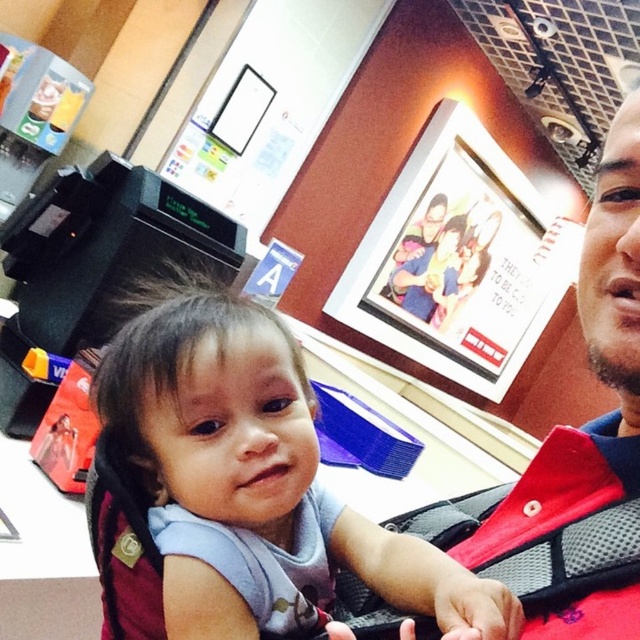
Does smooth blue bib at center appear on the left side of matte red shirt at upper right?

Correct, you'll find smooth blue bib at center to the left of matte red shirt at upper right.

Between smooth blue bib at center and matte red shirt at upper right, which one appears on the left side from the viewer's perspective?

From the viewer's perspective, smooth blue bib at center appears more on the left side.

Find the location of a particular element. This screenshot has height=640, width=640. smooth blue bib at center is located at coordinates pos(253,474).

Locate an element on the screen. The image size is (640, 640). smooth blue bib at center is located at coordinates (253, 474).